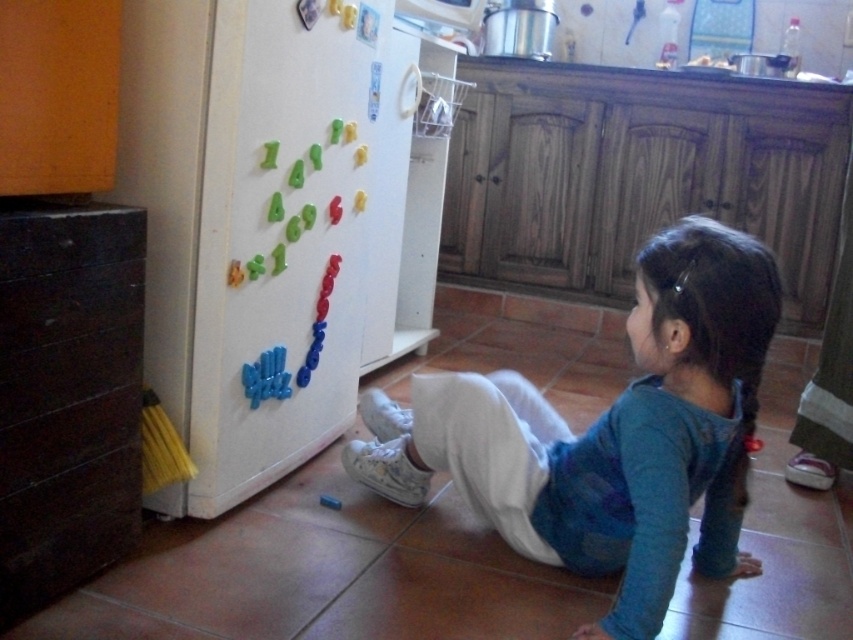
You are a parent who wants to store some small toys in the kitchen. You have a blue cotton shirt at lower center and a black wood drawer at left. Which object can you use to store the toys?

The black wood drawer at left can be used to store the toys because it is a drawer, which is typically designed for storage, while the blue cotton shirt at lower center is clothing and not suitable for storing items.

You are a parent trying to reach into the black wood drawer at left while keeping an eye on your child. Can you do so without moving away from the blue cotton shirt at lower center?

The blue cotton shirt at lower center is further to the viewer than the black wood drawer at left, so you can reach into the black wood drawer at left without moving away from the blue cotton shirt at lower center because it is closer to you.

You are a parent in the kitchen and want to store some small toys in the black wood drawer at left. However, you need to access it first. Since the white matte refrigerator at left is blocking your path, can you move around it to reach the drawer?

The black wood drawer at left is behind the white matte refrigerator at left, so you cannot directly access it without moving the refrigerator. Therefore, you cannot reach the drawer by moving around the refrigerator since it is blocking the path.